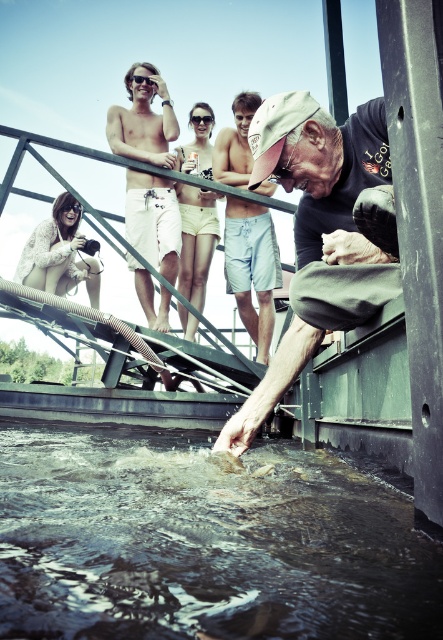
You are trying to decide which pair of shorts to wear for a day at the river. You have the matte khaki shorts at center and the beige cotton shorts at center. Which pair is more suitable for the water activity shown in the scene?

The matte khaki shorts at center is smaller than the beige cotton shorts at center, so the beige cotton shorts at center would be more suitable for water activities as they provide more coverage and comfort.

You are standing at the edge of the metal structure where the man is leaning. You want to reach a point that is exactly 1.60 meters away from you. Can you confirm if the point at coordinates point (x=373, y=113) matches this requirement?

The point at coordinates point (x=373, y=113) is exactly 1.60 meters away from the viewer, so yes, it matches the requirement.

You are standing at the point labeled point (119,589) and want to reach the edge of the water to take a photo. The distance between you and the water edge is 69.42 centimeters. If your camera requires you to be at least 50 centimeters away from the water to focus properly, can you take the photo from your current position?

The distance between point (119,589) and the water edge is 69.42 centimeters, which is more than the required 50 centimeters. Therefore, you can take the photo from your current position.